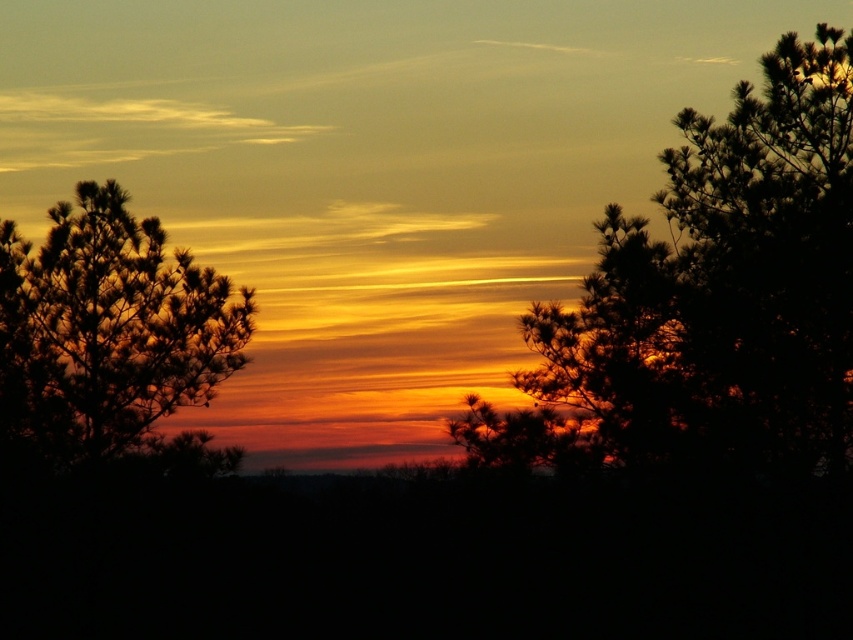
Looking at this image, you are an artist trying to paint the sunset scene. You notice the dark green textured tree at right and the silhouette pine tree at left. Which tree should you paint wider to accurately represent their sizes in the scene?

You should paint the dark green textured tree at right wider than the silhouette pine tree at left because its width surpasses the latter.

You are an artist trying to draw the sunset scene. You want to ensure the dark green textured tree at right and the silhouette pine tree at left are proportionally accurate. Which tree should you draw taller in your sketch?

The dark green textured tree at right should be drawn taller than the silhouette pine tree at left because it is much taller according to the description.